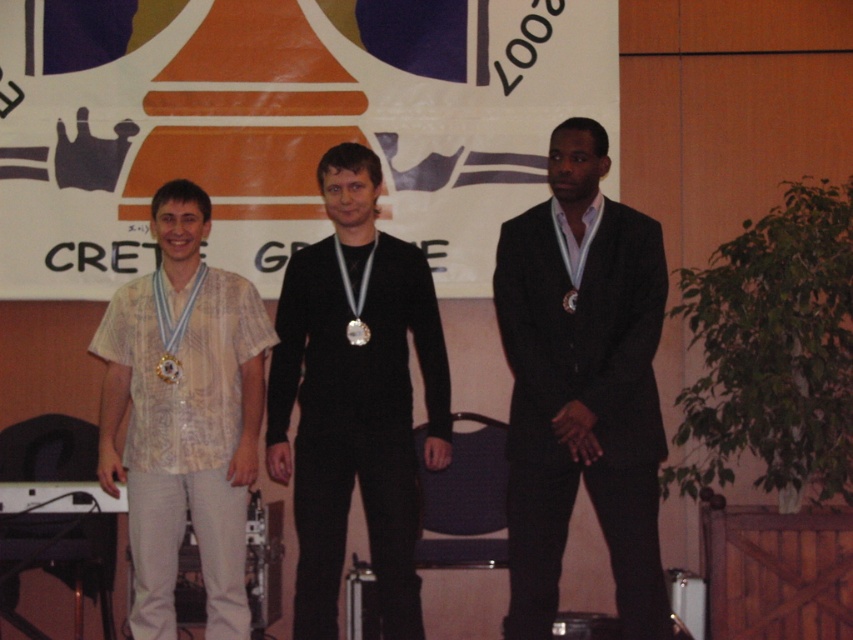
Question: Is dark suit at center below patterned fabric shirt at left?

Choices:
 (A) no
 (B) yes

Answer: (A)

Question: Which object appears farthest from the camera in this image?

Choices:
 (A) patterned fabric shirt at left
 (B) shiny silver medal at center
 (C) gold shiny medal at center
 (D) dark suit at center

Answer: (C)

Question: Based on their relative distances, which object is nearer to the dark suit at center?

Choices:
 (A) shiny silver medal at center
 (B) matte gold medal at left
 (C) gold shiny medal at center

Answer: (A)

Question: Is dark suit at center further to the viewer compared to patterned fabric shirt at left?

Choices:
 (A) no
 (B) yes

Answer: (A)

Question: Which is nearer to the gold shiny medal at center?

Choices:
 (A) shiny silver medal at center
 (B) matte gold medal at left

Answer: (A)

Question: Can you confirm if patterned fabric shirt at left is positioned above gold shiny medal at center?

Choices:
 (A) no
 (B) yes

Answer: (A)